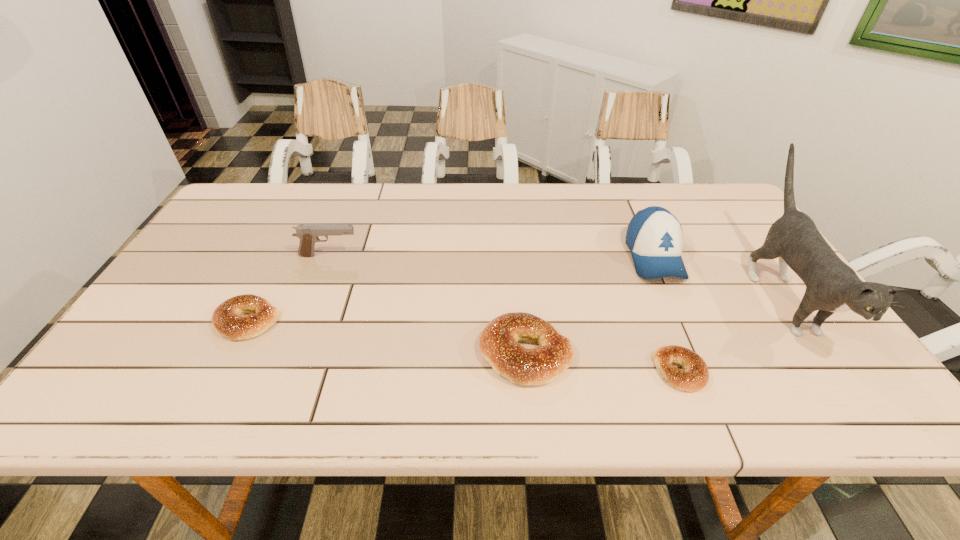
At what (x,y) coordinates should I click in order to perform the action: click on blank space at the right edge of the desktop. Please return your answer as a coordinate pair (x, y). Looking at the image, I should click on (733, 231).

The width and height of the screenshot is (960, 540). In the image, there is a desktop. In order to click on free space at the far left corner in this screenshot , I will do `click(234, 203)`.

I want to click on free space at the near left corner, so click(135, 363).

In the image, there is a desktop. At what (x,y) coordinates should I click in order to perform the action: click on free region at the near right corner. Please return your answer as a coordinate pair (x, y). Looking at the image, I should click on (826, 342).

The image size is (960, 540). I want to click on unoccupied position between the baseball cap and the second shortest bagel, so click(451, 289).

Image resolution: width=960 pixels, height=540 pixels. In order to click on free space that is in between the tallest object and the rightmost bagel in this screenshot , I will do `click(731, 334)`.

The height and width of the screenshot is (540, 960). What are the coordinates of `empty space that is in between the shortest bagel and the third tallest object` in the screenshot? It's located at (505, 313).

Find the location of a particular element. vacant space in between the second bagel from right to left and the cat is located at coordinates (654, 325).

This screenshot has width=960, height=540. In order to click on free space between the shortest bagel and the second tallest bagel in this screenshot , I will do `click(464, 346)`.

This screenshot has width=960, height=540. In order to click on free spot between the second shortest object and the tallest bagel in this screenshot , I will do [387, 337].